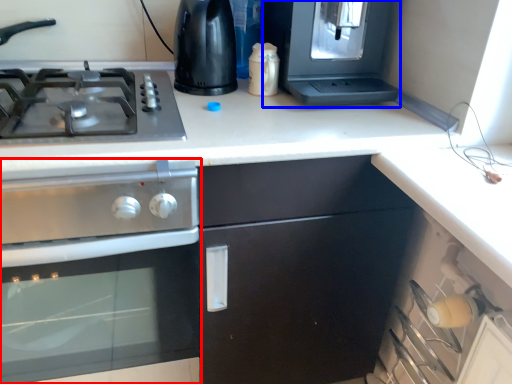
Question: Which object is closer to the camera taking this photo, kitchen appliance (highlighted by a red box) or appliance (highlighted by a blue box)?

Choices:
 (A) kitchen appliance
 (B) appliance

Answer: (A)